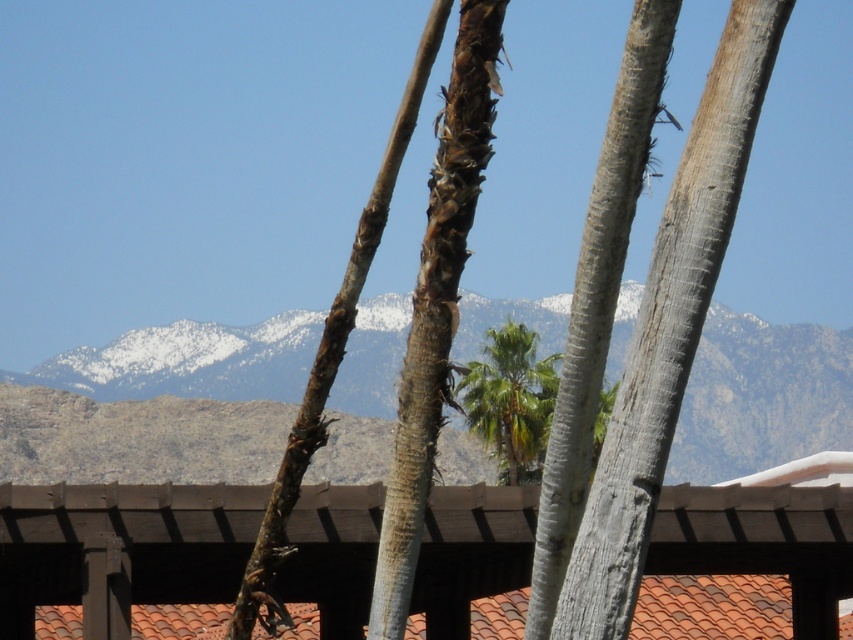
You are a hiker planning to take a photo of both the snowy rock mountain range at center and the green leafy palm tree at center. Can you position yourself so that both are fully visible in your camera frame without moving either object?

The snowy rock mountain range at center and green leafy palm tree at center are 18.61 meters apart from each other. Since both are positioned at the center of the scene, you can likely position yourself at a distance where the camera frame can capture both without needing to move either object.